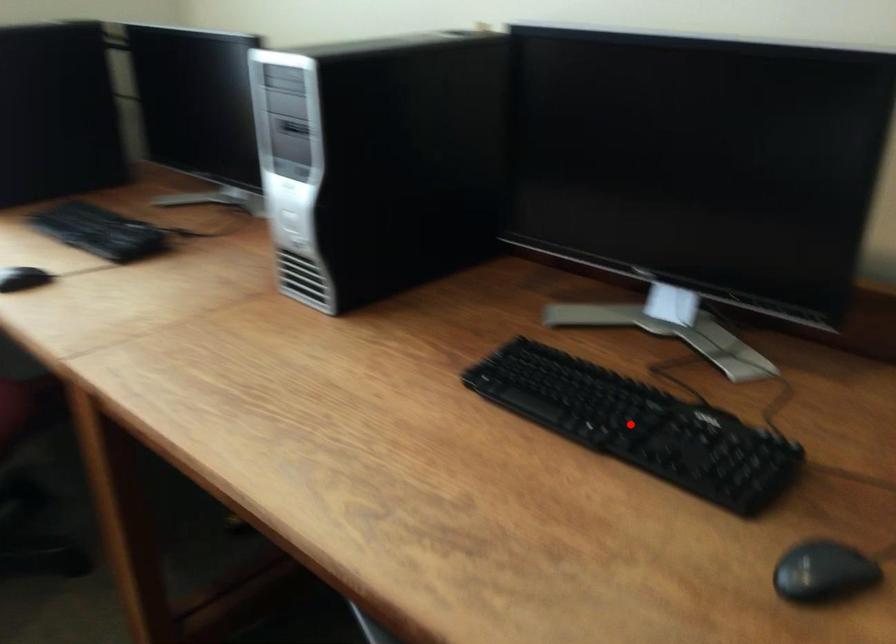
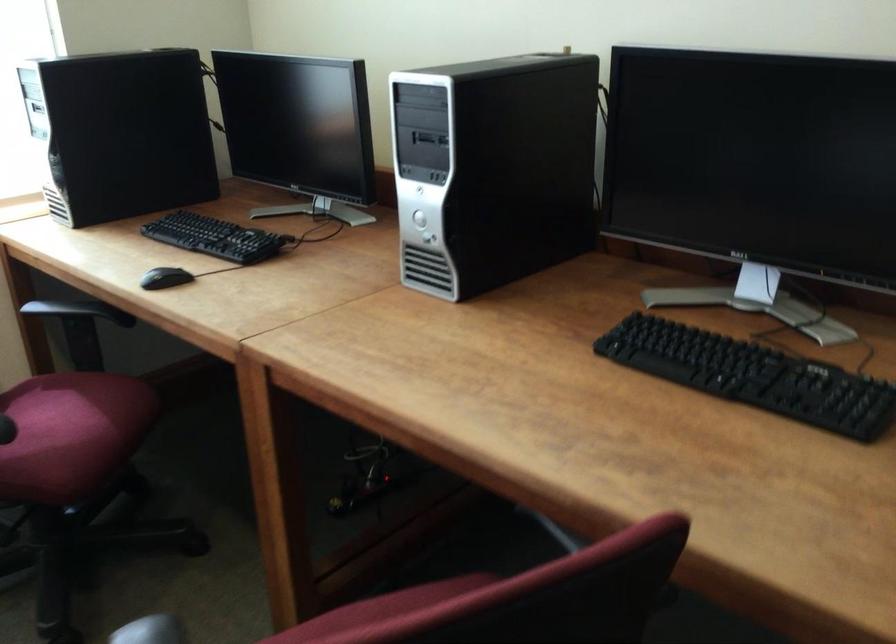
Question: I am providing you with two images of the same scene from different viewpoints. In image1, a red point is highlighted. Considering the same 3D point in image2, which of the following is correct?

Choices:
 (A) It is closer
 (B) It is farther

Answer: (B)